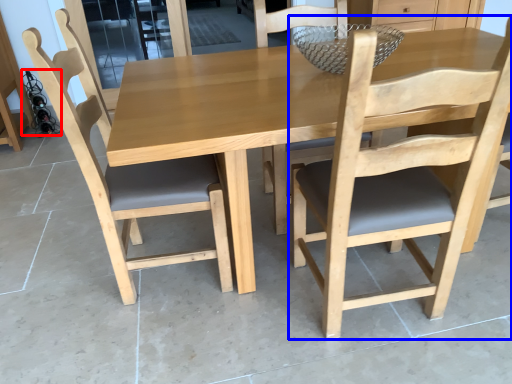
Question: Which point is closer to the camera, wine bottle (highlighted by a red box) or chair (highlighted by a blue box)?

Choices:
 (A) wine bottle
 (B) chair

Answer: (B)